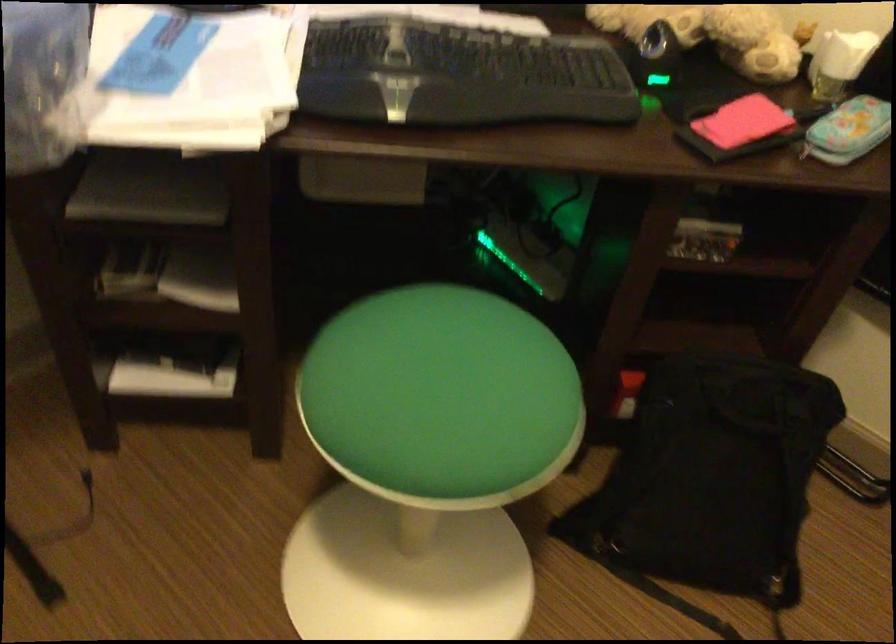
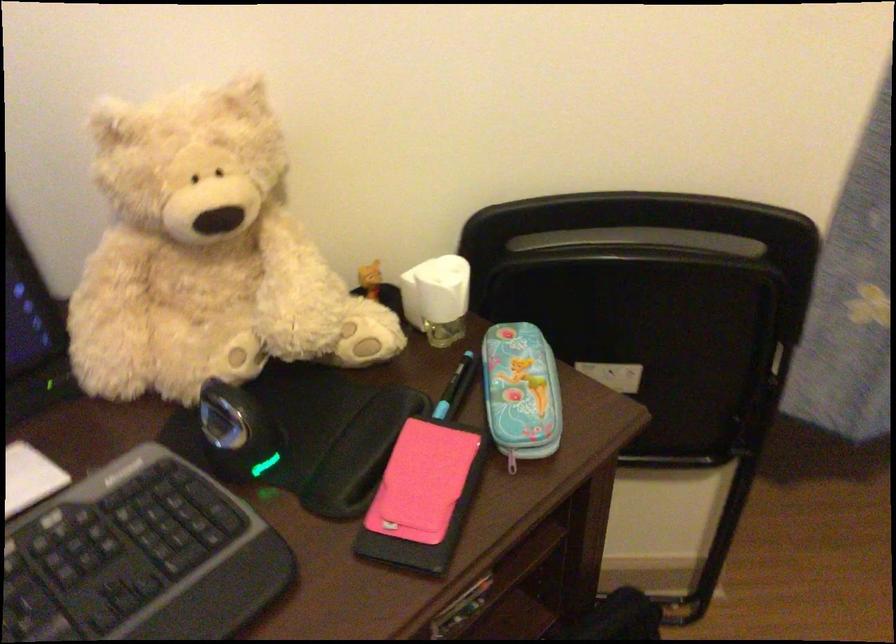
Locate, in the second image, the point that corresponds to (735,115) in the first image.

(421, 482)